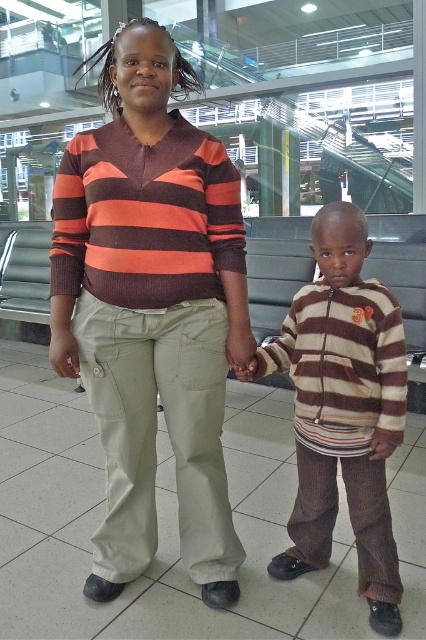
Based on the scene description, can you determine the exact coordinates of the matte striped sweater at center?

The 2D location of the matte striped sweater at center is at point [152,308].

You are a maintenance worker holding a 1.5 meter long tool. You need to reach the brown corduroy pants at lower right without moving them. Can you reach it with your tool?

The brown corduroy pants at lower right are 1.43 meters away from the viewer, so the 1.5 meter tool can reach it since it is slightly longer than the distance.

You are a photographer trying to capture a photo of the two people in the scene. The matte striped sweater at center and the brown corduroy pants at lower right are in your viewfinder. To ensure both are fully visible, should you adjust your camera angle to the left or the right?

The matte striped sweater at center is positioned on the left side of brown corduroy pants at lower right, so adjusting the camera angle to the right would ensure both are fully visible.